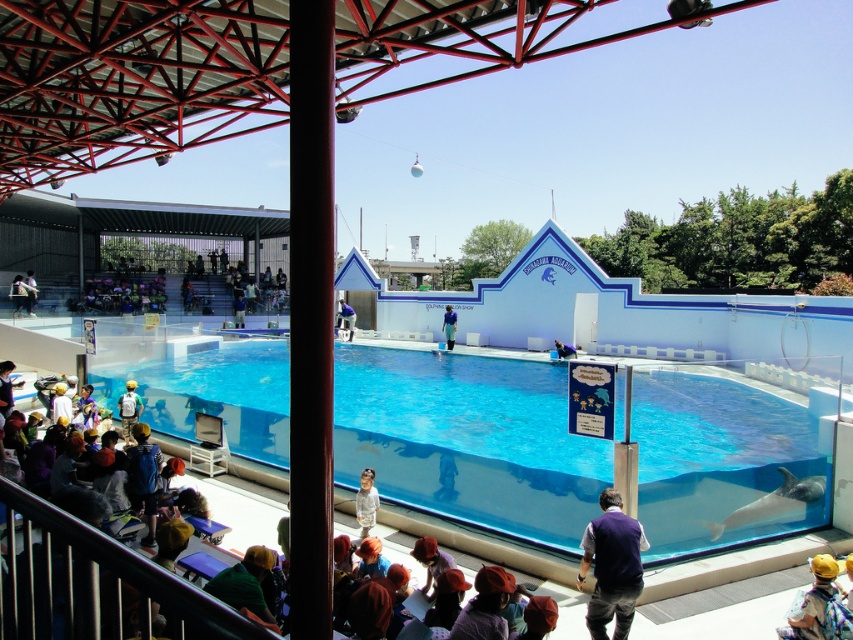
Does dark blue vest at lower center have a greater height compared to blue fabric at center?

No.

Is dark blue vest at lower center in front of blue fabric at center?

Yes, dark blue vest at lower center is closer to the viewer.

Image resolution: width=853 pixels, height=640 pixels. What do you see at coordinates (612, 566) in the screenshot?
I see `dark blue vest at lower center` at bounding box center [612, 566].

The image size is (853, 640). Identify the location of dark blue vest at lower center. (612, 566).

Who is taller, metallic gray rail at lower left or blue fabric shirt at center?

metallic gray rail at lower left

Can you confirm if metallic gray rail at lower left is thinner than blue fabric shirt at center?

No, metallic gray rail at lower left is not thinner than blue fabric shirt at center.

Is point (67, 516) closer to camera compared to point (350, 316)?

Yes, point (67, 516) is closer to viewer.

Locate an element on the screen. The width and height of the screenshot is (853, 640). metallic gray rail at lower left is located at coordinates (91, 579).

Can you confirm if yellow fabric backpack at lower right is positioned to the right of white matte jacket at center?

Yes, yellow fabric backpack at lower right is to the right of white matte jacket at center.

Is yellow fabric backpack at lower right closer to camera compared to white matte jacket at center?

Yes.

Which is behind, point (833, 604) or point (363, 518)?

The point (363, 518) is more distant.

The height and width of the screenshot is (640, 853). What are the coordinates of `yellow fabric backpack at lower right` in the screenshot? It's located at (819, 605).